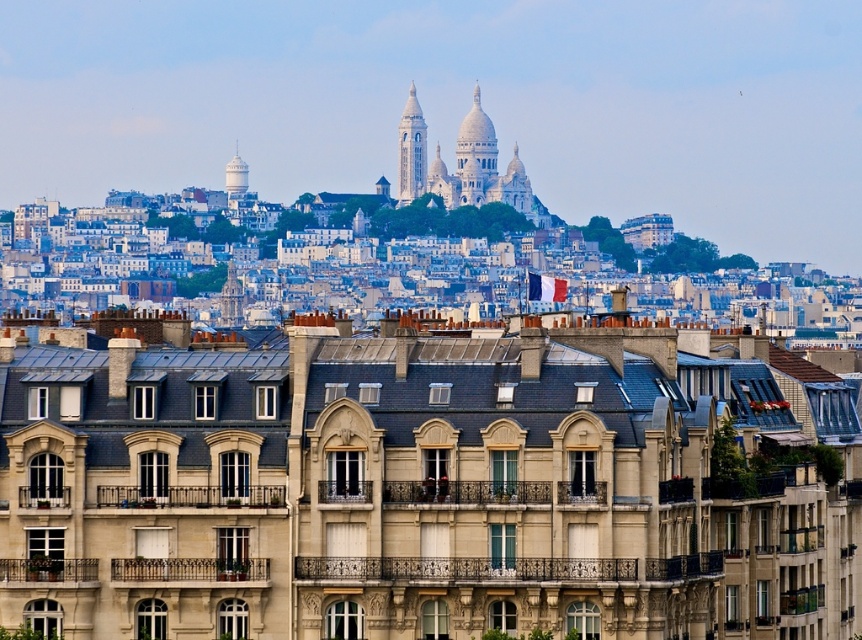
Can you confirm if white stone tower at center is wider than white glossy water tower at upper center?

Yes, white stone tower at center is wider than white glossy water tower at upper center.

In order to click on white stone tower at center in this screenshot , I will do `click(514, 186)`.

You are a GUI agent. You are given a task and a screenshot of the screen. Output one action in this format:
    pyautogui.click(x=<x>, y=<y>)
    Task: Click on the white stone tower at center
    
    Given the screenshot: What is the action you would take?
    pyautogui.click(x=514, y=186)

Who is more forward, (489,164) or (528,188)?

Point (489,164) is more forward.

What do you see at coordinates (475, 156) in the screenshot? Image resolution: width=862 pixels, height=640 pixels. I see `white stone dome at center` at bounding box center [475, 156].

Does point (475, 144) come farther from viewer compared to point (506, 202)?

No, it is in front of (506, 202).

Find the location of a particular element. The width and height of the screenshot is (862, 640). white stone dome at center is located at coordinates (475, 156).

You are a GUI agent. You are given a task and a screenshot of the screen. Output one action in this format:
    pyautogui.click(x=<x>, y=<y>)
    Task: Click on the white stone dome at center
    Image resolution: width=862 pixels, height=640 pixels.
    Given the screenshot: What is the action you would take?
    pyautogui.click(x=475, y=156)

Looking at this image, is white stone dome at center smaller than white stone tower at upper center?

No, white stone dome at center is not smaller than white stone tower at upper center.

I want to click on white stone dome at center, so click(x=475, y=156).

This screenshot has height=640, width=862. What are the coordinates of `white stone dome at center` in the screenshot? It's located at (475, 156).